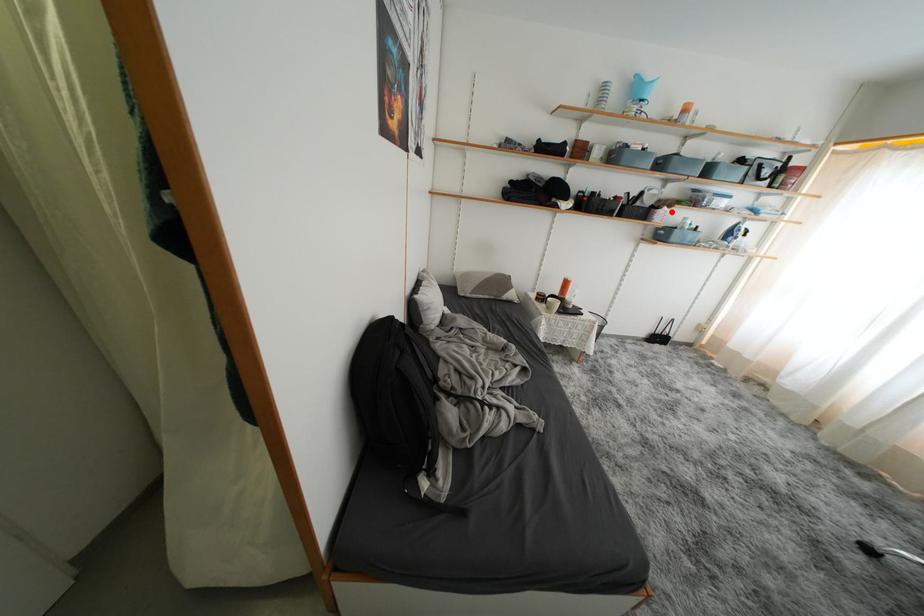
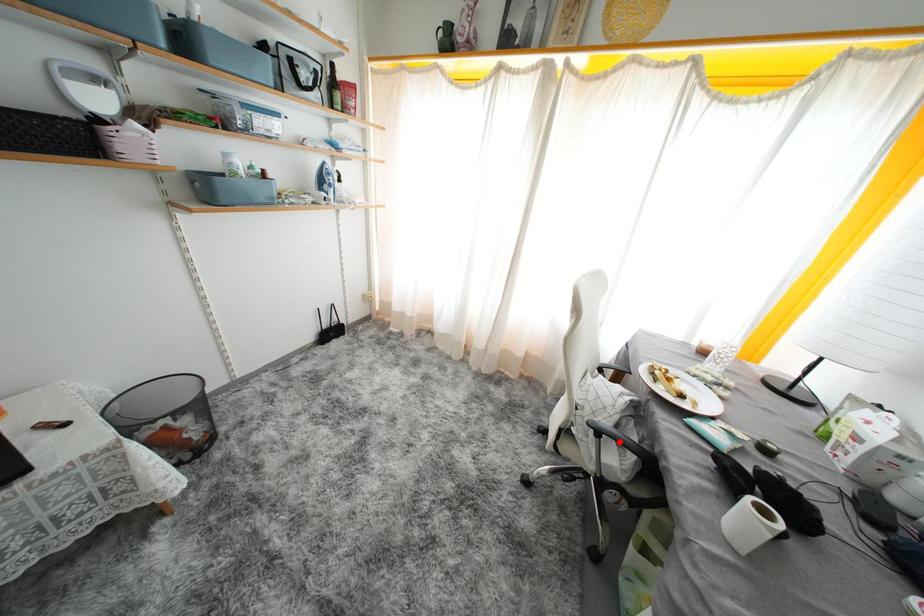
I am providing you with two images of the same scene from different viewpoints. A red point is marked on the first image and another point is marked on the second image. Do the highlighted points in image1 and image2 indicate the same real-world spot?

No